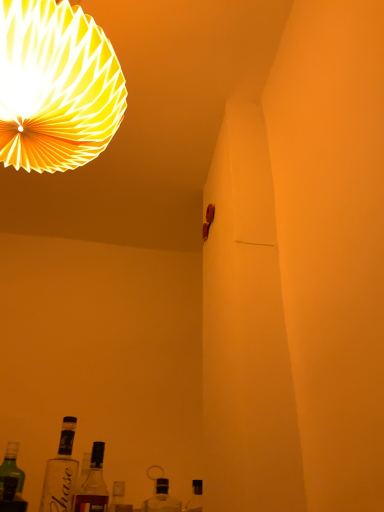
What is the approximate width of clear glass bottle at lower center, placed as the 3th bottle when sorted from left to right?

5.37 inches.

Image resolution: width=384 pixels, height=512 pixels. What do you see at coordinates (56, 86) in the screenshot?
I see `white paper lampshade at upper left` at bounding box center [56, 86].

The height and width of the screenshot is (512, 384). Identify the location of clear glass bottle at lower center, placed as the 3th bottle when sorted from left to right. (162, 499).

Can you confirm if white paper lampshade at upper left is thinner than translucent glass bottle at lower center, which is the second bottle in right-to-left order?

No, white paper lampshade at upper left is not thinner than translucent glass bottle at lower center, which is the second bottle in right-to-left order.

What's the angular difference between white paper lampshade at upper left and translucent glass bottle at lower center, which ranks as the second bottle in left-to-right order,'s facing directions?

The angular difference between white paper lampshade at upper left and translucent glass bottle at lower center, which ranks as the second bottle in left-to-right order, is 88.5 degrees.

I want to click on lamp lying in front of the translucent glass bottle at lower center, which ranks as the second bottle in left-to-right order, so click(56, 86).

Measure the distance between white paper lampshade at upper left and translucent glass bottle at lower center, which is the second bottle in right-to-left order.

white paper lampshade at upper left is 35.49 inches away from translucent glass bottle at lower center, which is the second bottle in right-to-left order.

Considering the relative sizes of clear glass bottle at lower center, placed as the 3th bottle when sorted from left to right, and white paper lampshade at upper left in the image provided, is clear glass bottle at lower center, placed as the 3th bottle when sorted from left to right, smaller than white paper lampshade at upper left?

Yes, clear glass bottle at lower center, placed as the 3th bottle when sorted from left to right, is smaller than white paper lampshade at upper left.

In the scene shown: Is clear glass bottle at lower center, placed as the 3th bottle when sorted from left to right, aimed at white paper lampshade at upper left?

No, clear glass bottle at lower center, placed as the 3th bottle when sorted from left to right, is not turned towards white paper lampshade at upper left.

Is clear glass bottle at lower center, placed as the 3th bottle when sorted from left to right, taller than white paper lampshade at upper left?

In fact, clear glass bottle at lower center, placed as the 3th bottle when sorted from left to right, may be shorter than white paper lampshade at upper left.

From the image's perspective, which object appears higher, translucent glass bottle at lower center, which is the second bottle in right-to-left order, or white paper lampshade at upper left?

white paper lampshade at upper left, from the image's perspective.

Consider the image. Choose the correct answer: Is translucent glass bottle at lower center, which ranks as the second bottle in left-to-right order, inside white paper lampshade at upper left or outside it?

translucent glass bottle at lower center, which ranks as the second bottle in left-to-right order, exists outside the volume of white paper lampshade at upper left.

Is point (93, 442) positioned behind point (26, 81)?

Yes.

Could you tell me if translucent glass bottle at lower center, which is the second bottle in right-to-left order, is turned towards white paper lampshade at upper left?

No, translucent glass bottle at lower center, which is the second bottle in right-to-left order, is not facing towards white paper lampshade at upper left.

How far apart are white paper lampshade at upper left and clear glass bottle at lower center, placed as the 3th bottle when sorted from left to right?

white paper lampshade at upper left and clear glass bottle at lower center, placed as the 3th bottle when sorted from left to right, are 3.74 feet apart.

From a real-world perspective, is white paper lampshade at upper left physically below clear glass bottle at lower center, placed as the 3th bottle when sorted from left to right?

No, from a real-world perspective, white paper lampshade at upper left is not beneath clear glass bottle at lower center, placed as the 3th bottle when sorted from left to right.

Considering the positions of point (66, 123) and point (158, 483), is point (66, 123) closer or farther from the camera than point (158, 483)?

Clearly, point (66, 123) is closer to the camera than point (158, 483).

Could you tell me if white paper lampshade at upper left is facing clear glass bottle at lower center, placed as the 1th bottle when sorted from right to left?

No.

Consider the image. How far apart are translucent glass bottle at lower center, which ranks as the second bottle in left-to-right order, and clear glass bottle at lower center, placed as the 1th bottle when sorted from right to left?

They are 21.93 centimeters apart.

Can you confirm if translucent glass bottle at lower center, which ranks as the second bottle in left-to-right order, is taller than clear glass bottle at lower center, placed as the 3th bottle when sorted from left to right?

Yes.

Would you say translucent glass bottle at lower center, which ranks as the second bottle in left-to-right order, is inside or outside clear glass bottle at lower center, placed as the 1th bottle when sorted from right to left?

The correct answer is: outside.

Which is farther from the camera, (97, 505) or (180, 508)?

Point (180, 508)

Could you tell me if clear glass bottle at lower left, the 3th bottle viewed from the right, is turned towards translucent glass bottle at lower center, which ranks as the second bottle in left-to-right order?

No, clear glass bottle at lower left, the 3th bottle viewed from the right, is not aimed at translucent glass bottle at lower center, which ranks as the second bottle in left-to-right order.

Is clear glass bottle at lower left, the 1th bottle positioned from the left, further to camera compared to translucent glass bottle at lower center, which ranks as the second bottle in left-to-right order?

No, clear glass bottle at lower left, the 1th bottle positioned from the left, is in front of translucent glass bottle at lower center, which ranks as the second bottle in left-to-right order.

How many degrees apart are the facing directions of clear glass bottle at lower left, the 1th bottle positioned from the left, and translucent glass bottle at lower center, which is the second bottle in right-to-left order?

The angle between the facing direction of clear glass bottle at lower left, the 1th bottle positioned from the left, and the facing direction of translucent glass bottle at lower center, which is the second bottle in right-to-left order, is 0.00242 degrees.

Considering the points (76, 75) and (54, 461), which point is in front, point (76, 75) or point (54, 461)?

Point (76, 75)

From the image's perspective, is white paper lampshade at upper left located above or below clear glass bottle at lower left, the 3th bottle viewed from the right?

white paper lampshade at upper left is situated higher than clear glass bottle at lower left, the 3th bottle viewed from the right, in the image.

Is white paper lampshade at upper left next to clear glass bottle at lower left, the 1th bottle positioned from the left, and touching it?

white paper lampshade at upper left and clear glass bottle at lower left, the 1th bottle positioned from the left, are not in contact.

Find the location of a particular element. This screenshot has height=512, width=384. bottle that is the 3rd object located behind the white paper lampshade at upper left is located at coordinates (93, 484).

Find the location of `lamp in front of the clear glass bottle at lower center, placed as the 1th bottle when sorted from right to left`. lamp in front of the clear glass bottle at lower center, placed as the 1th bottle when sorted from right to left is located at coordinates (56, 86).

Which object lies nearer to the anchor point clear glass bottle at lower left, the 1th bottle positioned from the left, translucent glass bottle at lower center, which ranks as the second bottle in left-to-right order, or clear glass bottle at lower center, placed as the 1th bottle when sorted from right to left?

translucent glass bottle at lower center, which ranks as the second bottle in left-to-right order, is closer to clear glass bottle at lower left, the 1th bottle positioned from the left.

Looking at the image, which one is located further to clear glass bottle at lower left, the 1th bottle positioned from the left, white paper lampshade at upper left or translucent glass bottle at lower center, which is the second bottle in right-to-left order?

Among the two, white paper lampshade at upper left is located further to clear glass bottle at lower left, the 1th bottle positioned from the left.

Looking at the image, which one is located further to white paper lampshade at upper left, clear glass bottle at lower center, placed as the 1th bottle when sorted from right to left, or translucent glass bottle at lower center, which is the second bottle in right-to-left order?

clear glass bottle at lower center, placed as the 1th bottle when sorted from right to left.

Which object lies nearer to the anchor point clear glass bottle at lower center, placed as the 3th bottle when sorted from left to right, clear glass bottle at lower left, the 3th bottle viewed from the right, or white paper lampshade at upper left?

clear glass bottle at lower left, the 3th bottle viewed from the right, lies closer to clear glass bottle at lower center, placed as the 3th bottle when sorted from left to right, than the other object.

Looking at the image, which one is located further to clear glass bottle at lower center, placed as the 1th bottle when sorted from right to left, translucent glass bottle at lower center, which is the second bottle in right-to-left order, or white paper lampshade at upper left?

Based on the image, white paper lampshade at upper left appears to be further to clear glass bottle at lower center, placed as the 1th bottle when sorted from right to left.

Which object lies nearer to the anchor point translucent glass bottle at lower center, which ranks as the second bottle in left-to-right order, white paper lampshade at upper left or clear glass bottle at lower center, placed as the 3th bottle when sorted from left to right?

clear glass bottle at lower center, placed as the 3th bottle when sorted from left to right, is positioned closer to the anchor translucent glass bottle at lower center, which ranks as the second bottle in left-to-right order.

Looking at the image, which one is located closer to white paper lampshade at upper left, clear glass bottle at lower left, the 1th bottle positioned from the left, or clear glass bottle at lower center, placed as the 1th bottle when sorted from right to left?

Based on the image, clear glass bottle at lower left, the 1th bottle positioned from the left, appears to be nearer to white paper lampshade at upper left.

Considering their positions, is clear glass bottle at lower left, the 1th bottle positioned from the left, positioned closer to white paper lampshade at upper left than translucent glass bottle at lower center, which is the second bottle in right-to-left order?

clear glass bottle at lower left, the 1th bottle positioned from the left, is positioned closer to the anchor white paper lampshade at upper left.

The width and height of the screenshot is (384, 512). Find the location of `bottle between white paper lampshade at upper left and translucent glass bottle at lower center, which is the second bottle in right-to-left order, in the up-down direction`. bottle between white paper lampshade at upper left and translucent glass bottle at lower center, which is the second bottle in right-to-left order, in the up-down direction is located at coordinates (61, 473).

Find the location of `bottle situated between clear glass bottle at lower left, the 1th bottle positioned from the left, and clear glass bottle at lower center, placed as the 3th bottle when sorted from left to right, from left to right`. bottle situated between clear glass bottle at lower left, the 1th bottle positioned from the left, and clear glass bottle at lower center, placed as the 3th bottle when sorted from left to right, from left to right is located at coordinates (93, 484).